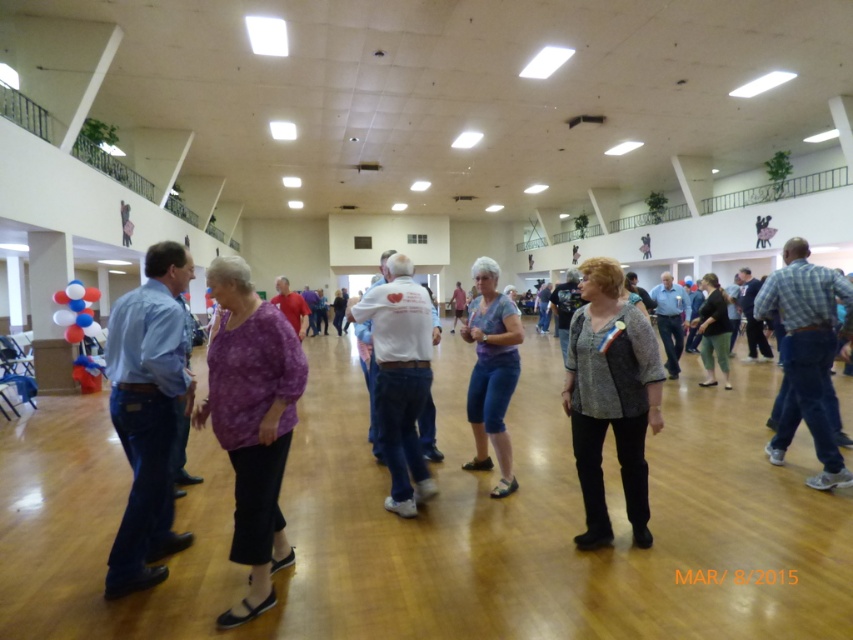
Is blue plaid shirt at right shorter than blue denim shorts at center?

No.

From the picture: Is blue plaid shirt at right to the left of blue denim shorts at center from the viewer's perspective?

No, blue plaid shirt at right is not to the left of blue denim shorts at center.

Where is `blue plaid shirt at right`? This screenshot has width=853, height=640. blue plaid shirt at right is located at coordinates (805, 353).

Can you confirm if purple fabric blouse at center is shorter than blue plaid shirt at right?

Yes.

Who is lower down, purple fabric blouse at center or blue plaid shirt at right?

purple fabric blouse at center

Locate an element on the screen. The width and height of the screenshot is (853, 640). purple fabric blouse at center is located at coordinates (252, 422).

Between blue plaid shirt at right and white cotton shirt at center, which one appears on the left side from the viewer's perspective?

From the viewer's perspective, white cotton shirt at center appears more on the left side.

Image resolution: width=853 pixels, height=640 pixels. Describe the element at coordinates (805, 353) in the screenshot. I see `blue plaid shirt at right` at that location.

You are a GUI agent. You are given a task and a screenshot of the screen. Output one action in this format:
    pyautogui.click(x=<x>, y=<y>)
    Task: Click on the blue plaid shirt at right
    
    Given the screenshot: What is the action you would take?
    pyautogui.click(x=805, y=353)